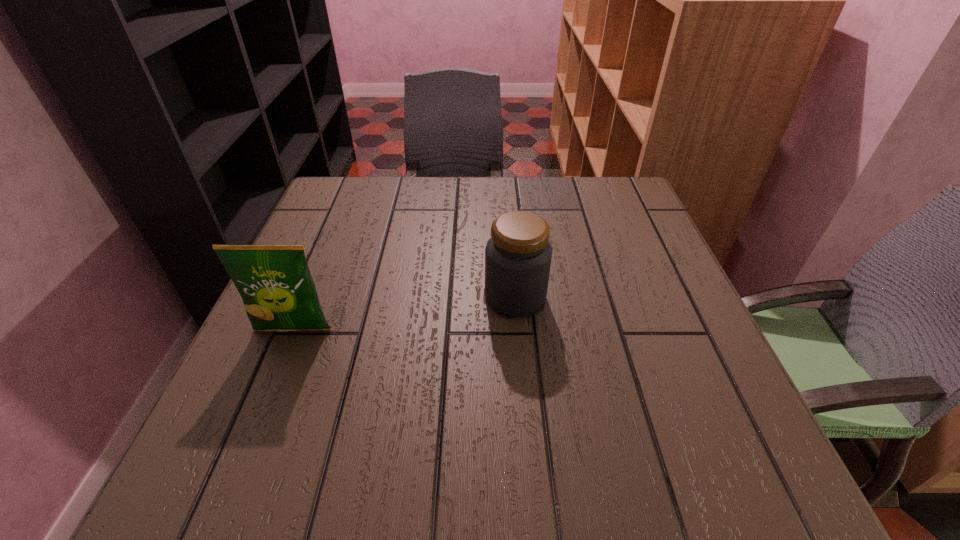
You are a GUI agent. You are given a task and a screenshot of the screen. Output one action in this format:
    pyautogui.click(x=<x>, y=<y>)
    Task: Click on the vacant region at the far left corner of the desktop
    
    Given the screenshot: What is the action you would take?
    pyautogui.click(x=327, y=199)

Where is `vacant space at the far right corner of the desktop`? This screenshot has width=960, height=540. vacant space at the far right corner of the desktop is located at coordinates (590, 226).

Image resolution: width=960 pixels, height=540 pixels. What are the coordinates of `vacant area at the near right corner` in the screenshot? It's located at (693, 483).

The height and width of the screenshot is (540, 960). Identify the location of blank space that satisfies the following two spatial constraints: 1. on the surface of the right object near the warning symbol; 2. on the front-facing side of the left object. pos(518,330).

The image size is (960, 540). In order to click on free space that satisfies the following two spatial constraints: 1. on the surface of the jar near the warning symbol; 2. on the front-facing side of the left object in this screenshot , I will do `click(518, 330)`.

I want to click on free space that satisfies the following two spatial constraints: 1. on the surface of the jar near the warning symbol; 2. on the front-facing side of the left object, so click(518, 330).

What are the coordinates of `free space that satisfies the following two spatial constraints: 1. on the surface of the right object near the warning symbol; 2. on the front-facing side of the left object` in the screenshot? It's located at (518, 330).

Find the location of a particular element. free spot that satisfies the following two spatial constraints: 1. on the surface of the jar near the warning symbol; 2. on the front-facing side of the left object is located at coordinates (518, 330).

Find the location of `free point that satisfies the following two spatial constraints: 1. on the surface of the jar near the warning symbol; 2. on the front-facing side of the crisp (potato chip)`. free point that satisfies the following two spatial constraints: 1. on the surface of the jar near the warning symbol; 2. on the front-facing side of the crisp (potato chip) is located at coordinates (518, 330).

This screenshot has height=540, width=960. I want to click on vacant space that satisfies the following two spatial constraints: 1. on the surface of the right object near the warning symbol; 2. on the front-facing side of the crisp (potato chip), so click(518, 330).